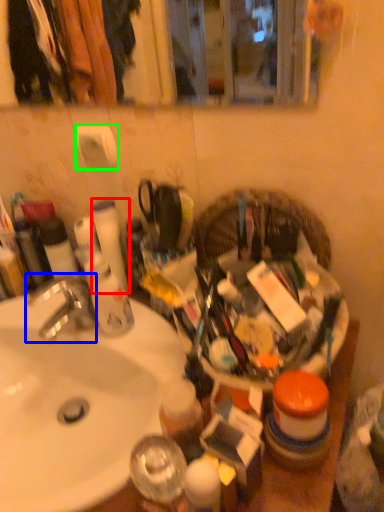
Question: Which object is positioned closest to toilet paper (highlighted by a red box)? Select from faucet (highlighted by a blue box) and toilet paper (highlighted by a green box).

Choices:
 (A) faucet
 (B) toilet paper

Answer: (B)